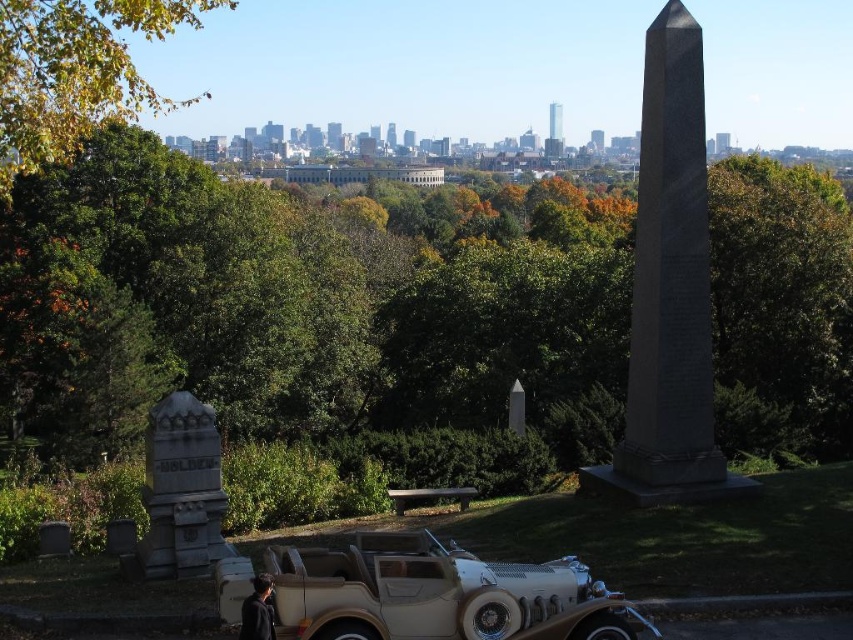
You are a photographer trying to capture both the granite obelisk at center and the green leafy tree at upper left in the same frame. Which object should you position closer to the camera to ensure both are fully visible?

To ensure both the granite obelisk at center and the green leafy tree at upper left are fully visible in the frame, you should position the granite obelisk at center closer to the camera since it is shorter than the green leafy tree at upper left.

You are standing at the point with coordinates point (x=192, y=541) and want to walk to the point with coordinates point (x=692, y=314). Will the vintage convertible car block your path?

Point (x=692, y=314) is behind point (x=192, y=541), so the vintage convertible car will block your path to the point (x=692, y=314).

You are standing at the point marked by the coordinates point (76, 72) in the park. Which object is directly in front of you?

The point (76, 72) is on green leafy tree at upper left, so the green leafy tree at upper left is directly in front of you.